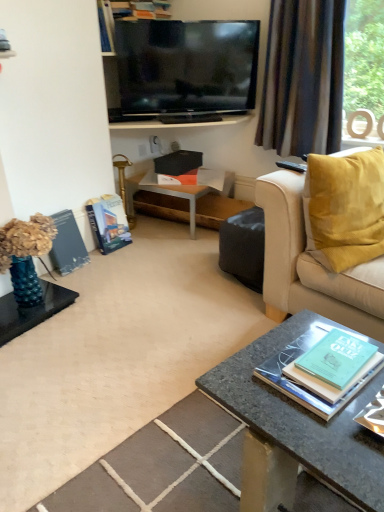
What do you see at coordinates (67, 244) in the screenshot? I see `matte black magazine at left, which is the first magazine in left-to-right order` at bounding box center [67, 244].

The width and height of the screenshot is (384, 512). I want to click on granite coffee table at lower center, so click(x=303, y=417).

Describe the element at coordinates (304, 385) in the screenshot. I see `green matte book at lower right, the 2th book positioned from the top` at that location.

This screenshot has width=384, height=512. What do you see at coordinates (166, 194) in the screenshot? I see `woodenwoodentable at center` at bounding box center [166, 194].

This screenshot has height=512, width=384. What do you see at coordinates (178, 178) in the screenshot?
I see `orange matte magazine at center, the 3th magazine positioned from the left` at bounding box center [178, 178].

Find the location of a particular element. hardcover book at upper center, the second book in the right-to-left sequence is located at coordinates (140, 9).

You are a GUI agent. You are given a task and a screenshot of the screen. Output one action in this format:
    pyautogui.click(x=<x>, y=<y>)
    Task: Click on the matte black magazine at left, which ranks as the third magazine in right-to-left order
    This screenshot has height=512, width=384.
    Given the screenshot: What is the action you would take?
    pyautogui.click(x=67, y=244)

From the image's perspective, which one is positioned lower, flat-screen tv at upper center or hardcover book at upper center, arranged as the 2th book when viewed from the front?

From the image's view, flat-screen tv at upper center is below.

Can you confirm if flat-screen tv at upper center is taller than hardcover book at upper center, arranged as the first book when viewed from the back?

Correct, flat-screen tv at upper center is much taller as hardcover book at upper center, arranged as the first book when viewed from the back.

Looking at this image, looking at their sizes, would you say flat-screen tv at upper center is wider or thinner than hardcover book at upper center, which ranks as the first book in left-to-right order?

In the image, flat-screen tv at upper center appears to be more narrow than hardcover book at upper center, which ranks as the first book in left-to-right order.

From a real-world perspective, who is located lower, flat-screen tv at upper center or hardcover book at upper center, which is the 2th book in bottom-to-top order?

flat-screen tv at upper center.

Between hardcover book at upper center, which is the 2th book in bottom-to-top order, and woodenwoodentable at center, which one has larger size?

With larger size is woodenwoodentable at center.

Is point (142, 16) positioned after point (198, 187)?

That is False.

Would you say hardcover book at upper center, which is the 2th book in bottom-to-top order, is inside or outside woodenwoodentable at center?

hardcover book at upper center, which is the 2th book in bottom-to-top order, cannot be found inside woodenwoodentable at center.

Is hardcover book at upper center, which is the 2th book in bottom-to-top order, aimed at woodenwoodentable at center?

No, hardcover book at upper center, which is the 2th book in bottom-to-top order, does not turn towards woodenwoodentable at center.

Does flat-screen tv at upper center have a lesser height compared to brown textured curtain at upper right?

Yes, flat-screen tv at upper center is shorter than brown textured curtain at upper right.

Is point (195, 95) behind point (276, 136)?

Yes.

From a real-world perspective, is flat-screen tv at upper center physically below brown textured curtain at upper right?

No, from a real-world perspective, flat-screen tv at upper center is not below brown textured curtain at upper right.

The width and height of the screenshot is (384, 512). There is a woodenwoodentable at center. Identify the location of the 2nd magazine below it (from the image's perspective). (67, 244).

Is point (129, 191) farther from camera compared to point (87, 254)?

Yes, it is.

From a real-world perspective, who is located lower, flat-screen tv at upper center or woodenwoodentable at center?

woodenwoodentable at center.

How many degrees apart are the facing directions of flat-screen tv at upper center and woodenwoodentable at center?

The angle between the facing direction of flat-screen tv at upper center and the facing direction of woodenwoodentable at center is 46.7 degrees.

From the image's perspective, between flat-screen tv at upper center and woodenwoodentable at center, who is located below?

woodenwoodentable at center is shown below in the image.

Is flat-screen tv at upper center not within woodenwoodentable at center?

Indeed, flat-screen tv at upper center is completely outside woodenwoodentable at center.

From the picture: Do you think orange matte magazine at center, the first magazine viewed from the right, is within granite coffee table at lower center, or outside of it?

orange matte magazine at center, the first magazine viewed from the right, is located beyond the bounds of granite coffee table at lower center.

From the image's perspective, which is above, orange matte magazine at center, the first magazine viewed from the right, or granite coffee table at lower center?

orange matte magazine at center, the first magazine viewed from the right, is shown above in the image.

Between orange matte magazine at center, the 3th magazine positioned from the left, and granite coffee table at lower center, which one has less height?

Standing shorter between the two is orange matte magazine at center, the 3th magazine positioned from the left.

From a real-world perspective, is hardcover book at upper center, acting as the first book starting from the top, over smooth stone coffee table at center?

Yes, from a real-world perspective, hardcover book at upper center, acting as the first book starting from the top, is above smooth stone coffee table at center.

Is hardcover book at upper center, arranged as the 2th book when viewed from the front, facing towards smooth stone coffee table at center?

No, hardcover book at upper center, arranged as the 2th book when viewed from the front, is not facing towards smooth stone coffee table at center.

Between hardcover book at upper center, acting as the first book starting from the top, and smooth stone coffee table at center, which one has smaller width?

With smaller width is hardcover book at upper center, acting as the first book starting from the top.

Between hardcover book at upper center, acting as the first book starting from the top, and smooth stone coffee table at center, which one has more height?

With more height is hardcover book at upper center, acting as the first book starting from the top.

Locate an element on the screen. This screenshot has height=512, width=384. book above the flat-screen tv at upper center (from the image's perspective) is located at coordinates (140, 9).

This screenshot has height=512, width=384. Find the location of `table on the right of hardcover book at upper center, which ranks as the first book in left-to-right order`. table on the right of hardcover book at upper center, which ranks as the first book in left-to-right order is located at coordinates (166, 194).

Considering their positions, is beige fabric couch at right positioned closer to woodenwoodentable at center than flat-screen tv at upper center?

The object closer to woodenwoodentable at center is flat-screen tv at upper center.

Which object lies nearer to the anchor point woodenwoodentable at center, flat-screen tv at upper center or matte black magazine at left, which is the first magazine in left-to-right order?

flat-screen tv at upper center.

Based on their spatial positions, is green matte book at lower right, which is counted as the 2th book, starting from the back, or matte black magazine at left, which is the first magazine in left-to-right order, further from flat-screen tv at upper center?

green matte book at lower right, which is counted as the 2th book, starting from the back.

Based on their spatial positions, is beige fabric couch at right or granite coffee table at lower center closer to flat-screen tv at upper center?

beige fabric couch at right lies closer to flat-screen tv at upper center than the other object.

Estimate the real-world distances between objects in this image. Which object is further from smooth stone coffee table at center, green matte book at lower right, placed as the second book when sorted from left to right, or orange matte magazine at center, the 3th magazine positioned from the left?

orange matte magazine at center, the 3th magazine positioned from the left, lies further to smooth stone coffee table at center than the other object.

Estimate the real-world distances between objects in this image. Which object is closer to hardcover book at upper center, which ranks as the first book in left-to-right order, granite coffee table at lower center or flat-screen tv at upper center?

flat-screen tv at upper center.

From the image, which object appears to be nearer to brown textured curtain at upper right, flat-screen tv at upper center or smooth stone coffee table at center?

The object closer to brown textured curtain at upper right is flat-screen tv at upper center.

Based on their spatial positions, is granite coffee table at lower center or hardcover book at upper center, the second book in the right-to-left sequence, further from brown textured curtain at upper right?

The object further to brown textured curtain at upper right is granite coffee table at lower center.

Where is `book between smooth stone coffee table at center and beige fabric couch at right`? book between smooth stone coffee table at center and beige fabric couch at right is located at coordinates (304, 385).

Where is `studio couch located between smooth stone coffee table at center and hardcover book at left, acting as the 2th magazine starting from the left, in the depth direction`? studio couch located between smooth stone coffee table at center and hardcover book at left, acting as the 2th magazine starting from the left, in the depth direction is located at coordinates (312, 265).

Identify the location of book between beige fabric couch at right and granite coffee table at lower center vertically. The image size is (384, 512). (304, 385).

This screenshot has width=384, height=512. I want to click on table between matte black magazine at left, which ranks as the third magazine in right-to-left order, and brown textured curtain at upper right, so click(166, 194).